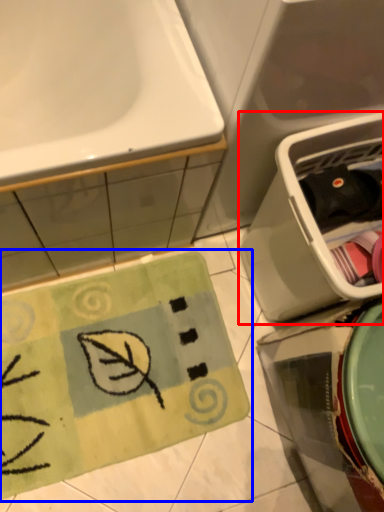
Question: Which object appears closest to the camera in this image, dish washer (highlighted by a red box) or doormat (highlighted by a blue box)?

Choices:
 (A) dish washer
 (B) doormat

Answer: (A)